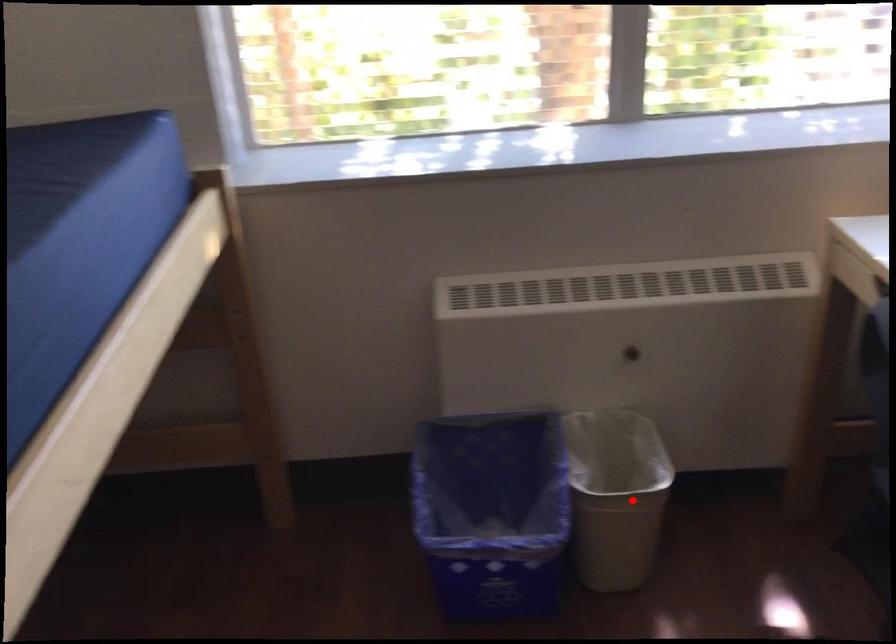
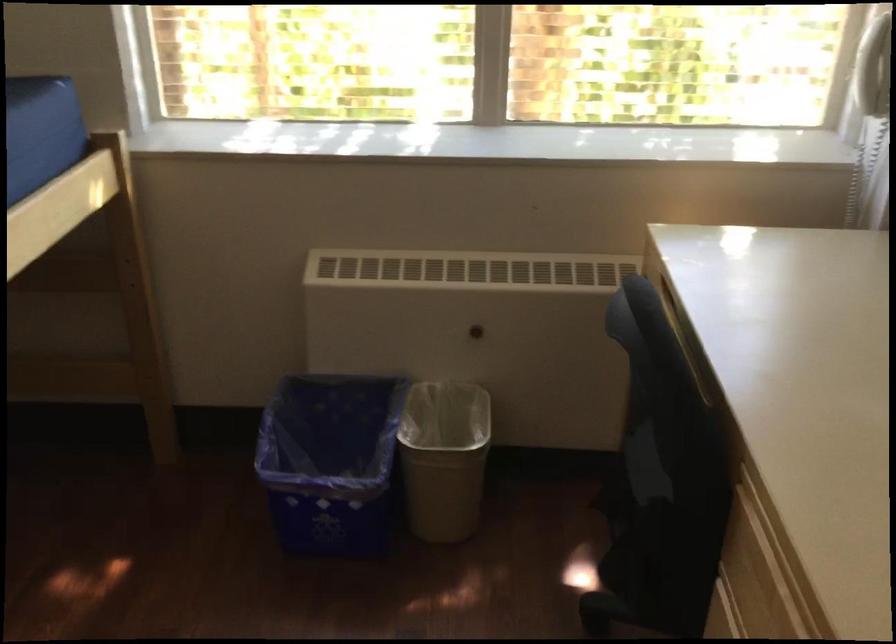
The point at the highlighted location is marked in the first image. Where is the corresponding point in the second image?

(444, 458)